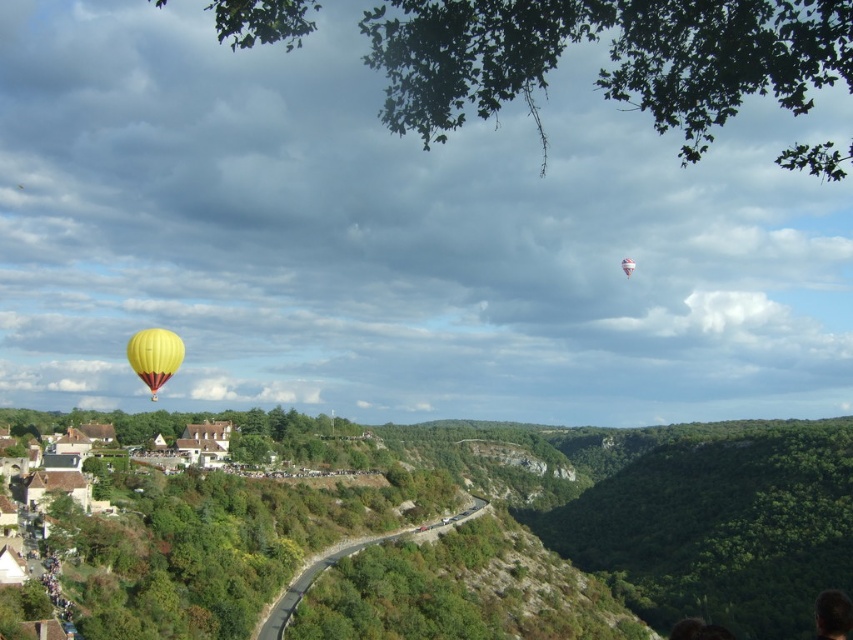
You are a pilot in the yellow fabric balloon at lower left and want to ascend to the same height as the yellow fabric hot air balloon at upper left. Based on the scene, is your balloon currently below or above the other balloon?

The yellow fabric balloon at lower left is positioned under the yellow fabric hot air balloon at upper left, so it is currently below the other balloon.

You are standing at the point with coordinates point (167, 362) and want to walk towards point (622, 268). What direction should you walk in?

You should walk towards point (622, 268). Since point (167, 362) is in front of point (622, 268), you need to move backward in the scene to reach your destination.